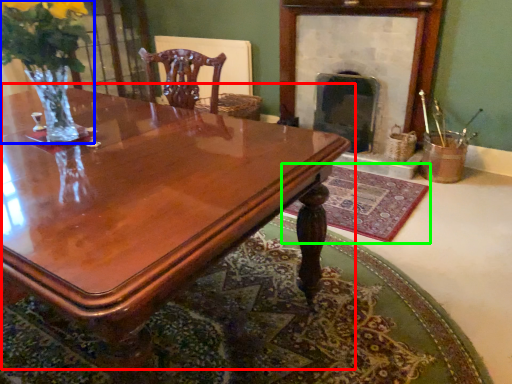
Question: Which object is the farthest from coffee table (highlighted by a red box)? Choose among these: floral arrangement (highlighted by a blue box) or mat (highlighted by a green box).

Choices:
 (A) floral arrangement
 (B) mat

Answer: (B)